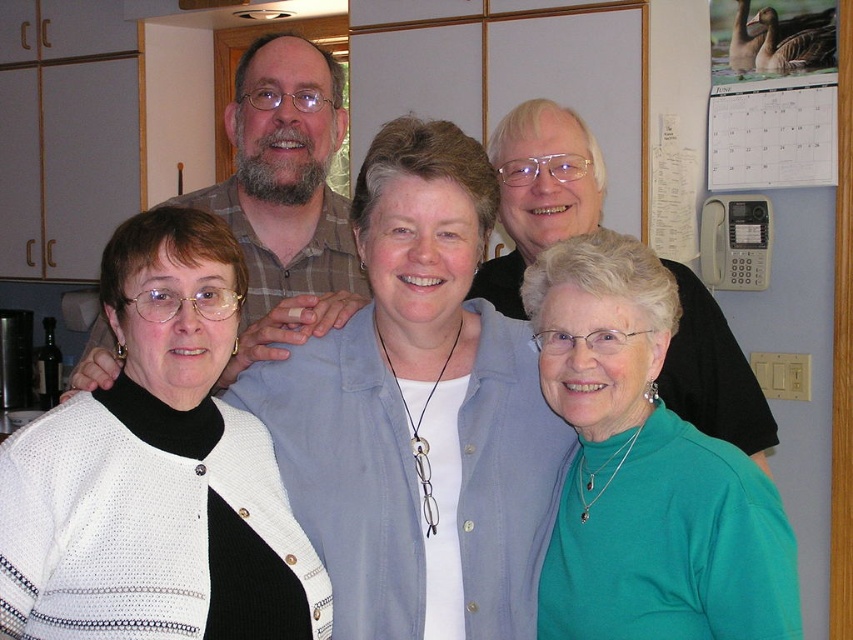
You are a photographer setting up a tripod in the center of the room. You see the light blue shirt at center and the plaid shirt at center. Which one is closer to the ceiling?

The light blue shirt at center is taller than the plaid shirt at center, so the light blue shirt at center is closer to the ceiling.